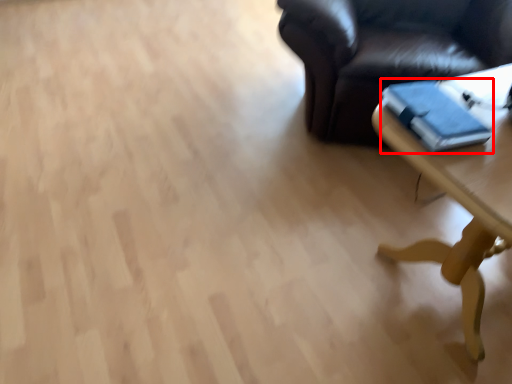
Question: From the image's perspective, where is book (annotated by the red box) located relative to table?

Choices:
 (A) above
 (B) below

Answer: (A)